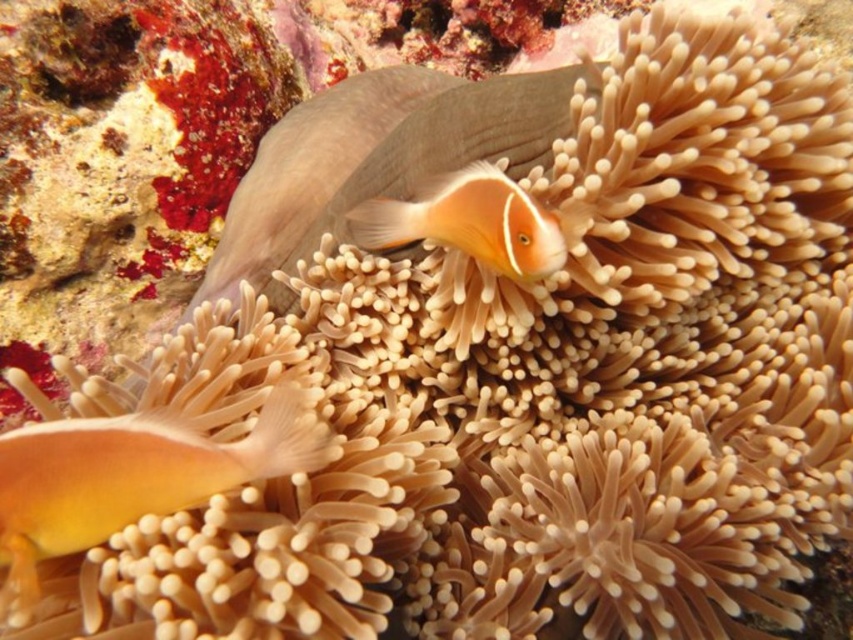
Question: Where is orange matte fish at center located in relation to translucent orange fish at lower left in the image?

Choices:
 (A) above
 (B) below

Answer: (A)

Question: Which point is farther from the camera taking this photo?

Choices:
 (A) (434, 154)
 (B) (440, 227)

Answer: (A)

Question: Based on their relative distances, which object is farther from the orange matte clownfish at center?

Choices:
 (A) orange matte fish at center
 (B) translucent orange fish at lower left

Answer: (B)

Question: Does orange matte fish at center come behind orange matte clownfish at center?

Choices:
 (A) yes
 (B) no

Answer: (A)

Question: Is orange matte fish at center wider than orange matte clownfish at center?

Choices:
 (A) no
 (B) yes

Answer: (B)

Question: Which of these objects is positioned closest to the orange matte fish at center?

Choices:
 (A) orange matte clownfish at center
 (B) translucent orange fish at lower left

Answer: (A)